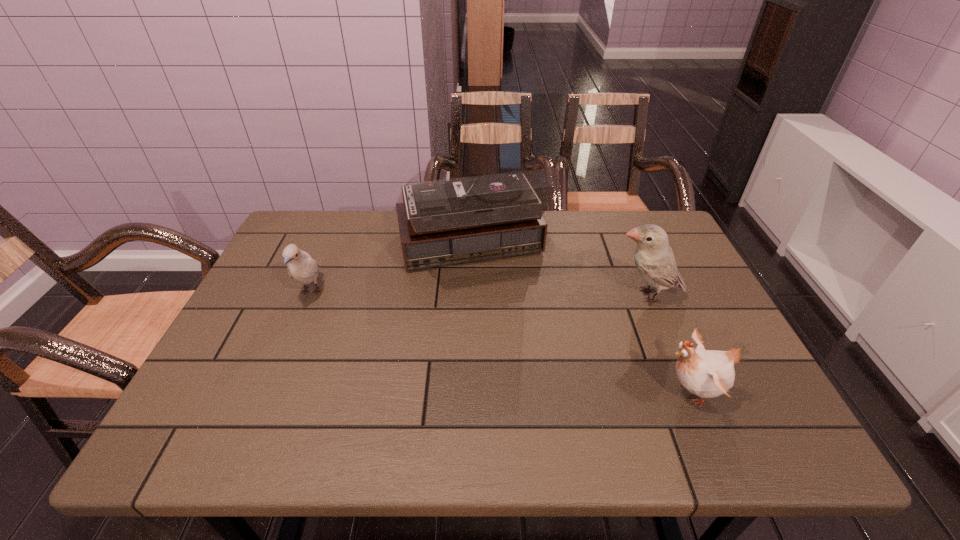
The image size is (960, 540). I want to click on the tallest object, so click(451, 221).

Find the location of a particular element. record player is located at coordinates (451, 221).

Where is `the tallest bird`? the tallest bird is located at coordinates (654, 259).

The image size is (960, 540). In order to click on the leftmost bird in this screenshot , I will do `click(301, 267)`.

Where is `the nearest bird`? the nearest bird is located at coordinates [x=706, y=373].

At what (x,y) coordinates should I click in order to perform the action: click on vacant space located on the left of the second object from left to right. Please return your answer as a coordinate pair (x, y). Looking at the image, I should click on (316, 253).

Locate an element on the screen. The image size is (960, 540). vacant space located 0.210m at the face of the second tallest object is located at coordinates (529, 296).

Find the location of a particular element. The height and width of the screenshot is (540, 960). vacant area situated 0.370m at the face of the second tallest object is located at coordinates (468, 296).

You are a GUI agent. You are given a task and a screenshot of the screen. Output one action in this format:
    pyautogui.click(x=<x>, y=<y>)
    Task: Click on the vacant space located at the face of the second tallest object
    The width and height of the screenshot is (960, 540).
    Given the screenshot: What is the action you would take?
    pyautogui.click(x=456, y=296)

This screenshot has height=540, width=960. I want to click on blank space located 0.280m at the beak of the leftmost bird, so click(x=260, y=413).